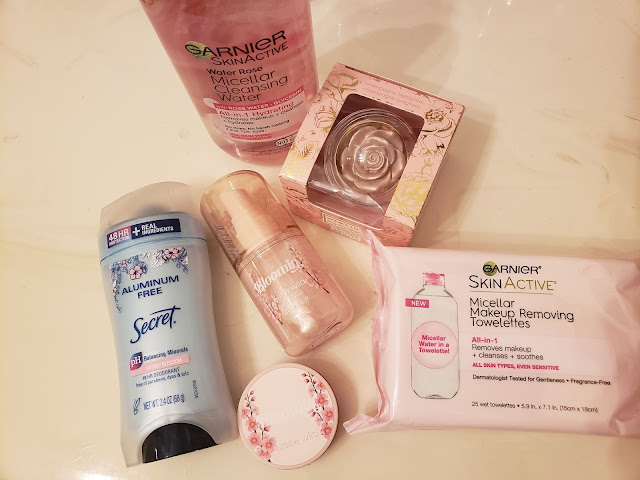
You are a GUI agent. You are given a task and a screenshot of the screen. Output one action in this format:
    pyautogui.click(x=<x>, y=<y>)
    Task: Click on the makeup removing towelettes
    
    Given the screenshot: What is the action you would take?
    pyautogui.click(x=587, y=293)